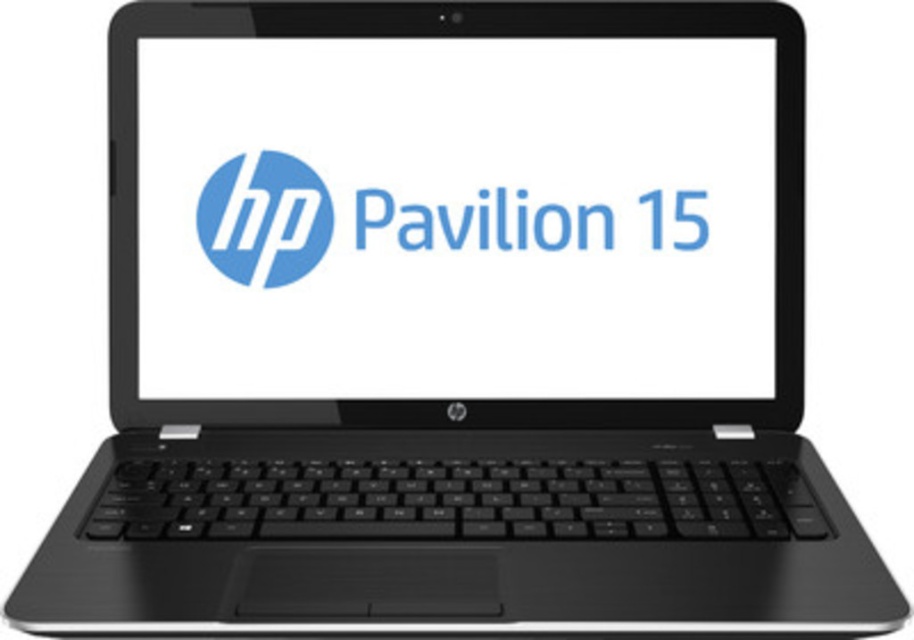
Based on the photo, is matte black laptop at center shorter than matte blue circle at center?

Incorrect, matte black laptop at center's height does not fall short of matte blue circle at center's.

Which of these two, matte black laptop at center or matte blue circle at center, stands taller?

Standing taller between the two is matte black laptop at center.

Is point (193, 268) positioned before point (288, 156)?

No, it is behind (288, 156).

At what (x,y) coordinates should I click in order to perform the action: click on matte black laptop at center. Please return your answer as a coordinate pair (x, y). Looking at the image, I should click on (457, 218).